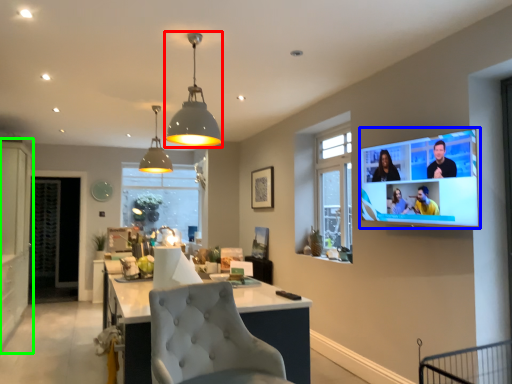
Question: Which object is the farthest from light fixture (highlighted by a red box)? Choose among these: tv show (highlighted by a blue box) or cabinetry (highlighted by a green box).

Choices:
 (A) tv show
 (B) cabinetry

Answer: (B)